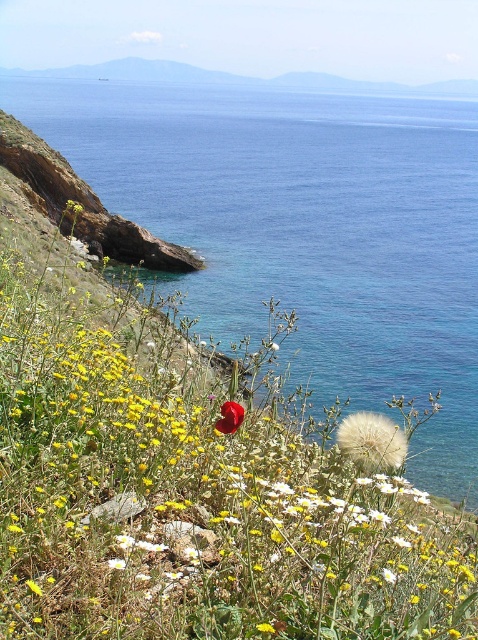
Which is above, red matte poppy at center or bright red petal at center?

bright red petal at center

Does red matte poppy at center have a larger size compared to bright red petal at center?

Yes, red matte poppy at center is bigger than bright red petal at center.

Which is in front, point (56, 435) or point (221, 429)?

Point (221, 429) is in front.

The height and width of the screenshot is (640, 478). In order to click on red matte poppy at center in this screenshot , I will do `click(195, 508)`.

Is red matte poppy at center wider than blue water at center?

In fact, red matte poppy at center might be narrower than blue water at center.

Does point (231, 573) come behind point (476, 128)?

No, (231, 573) is closer to viewer.

Locate an element on the screen. The width and height of the screenshot is (478, 640). red matte poppy at center is located at coordinates (195, 508).

Can you confirm if white fluffy dandelion at center is positioned to the right of bright red petal at center?

Correct, you'll find white fluffy dandelion at center to the right of bright red petal at center.

Can you confirm if white fluffy dandelion at center is thinner than bright red petal at center?

Incorrect, white fluffy dandelion at center's width is not less than bright red petal at center's.

This screenshot has height=640, width=478. What do you see at coordinates (371, 442) in the screenshot?
I see `white fluffy dandelion at center` at bounding box center [371, 442].

This screenshot has height=640, width=478. I want to click on white fluffy dandelion at center, so click(x=371, y=442).